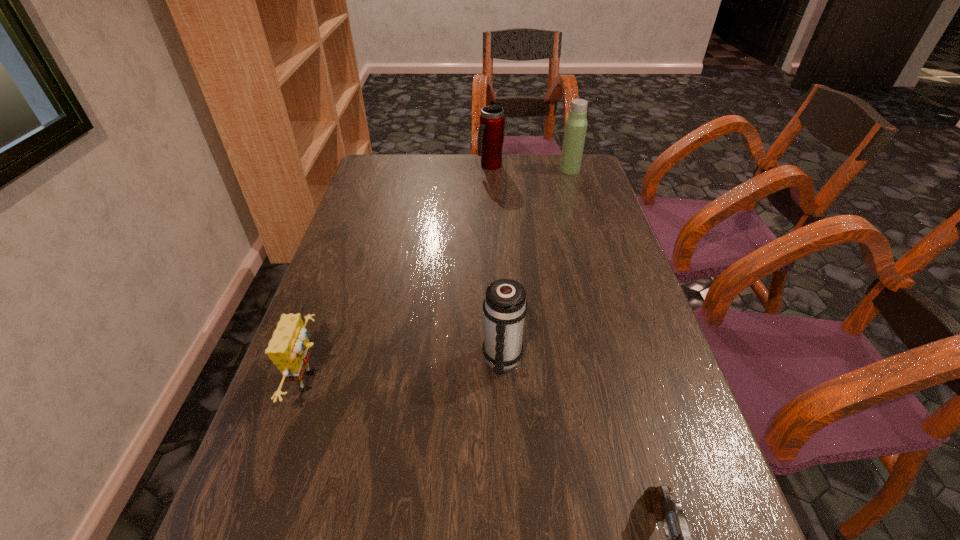
I want to click on free space in the image that satisfies the following two spatial constraints: 1. on the side with the handle of the nearest thermos bottle; 2. on the face of the sponge, so click(504, 381).

Locate an element on the screen. This screenshot has width=960, height=540. vacant space that satisfies the following two spatial constraints: 1. on the front side of the rightmost thermos bottle; 2. on the face of the sponge is located at coordinates (635, 381).

Find the location of a particular element. This screenshot has width=960, height=540. free location that satisfies the following two spatial constraints: 1. on the side with the handle of the nearest thermos bottle; 2. on the face of the leftmost object is located at coordinates (504, 381).